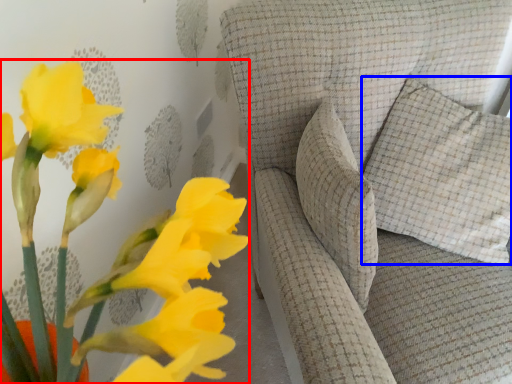
Question: Among these objects, which one is nearest to the camera, floral arrangement (highlighted by a red box) or pillow (highlighted by a blue box)?

Choices:
 (A) floral arrangement
 (B) pillow

Answer: (A)